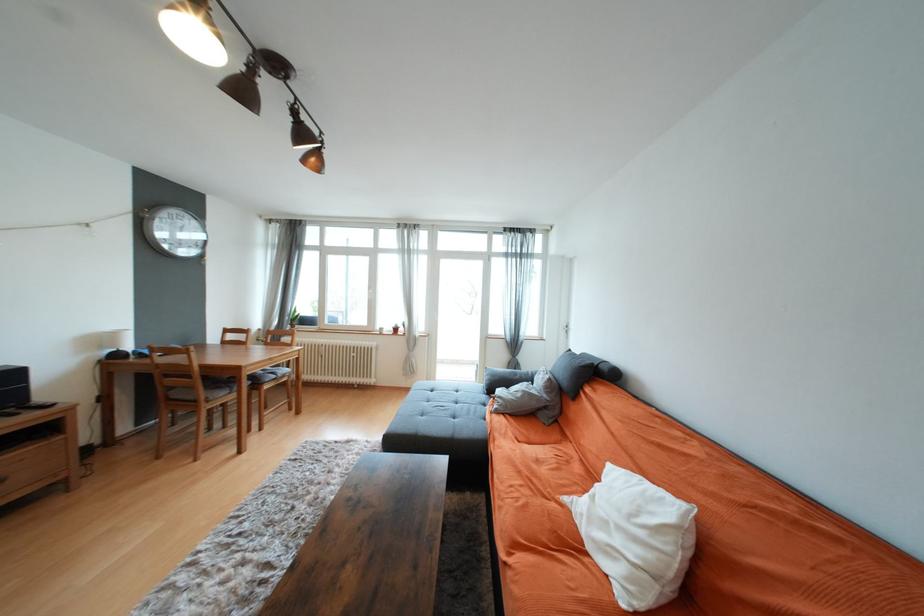
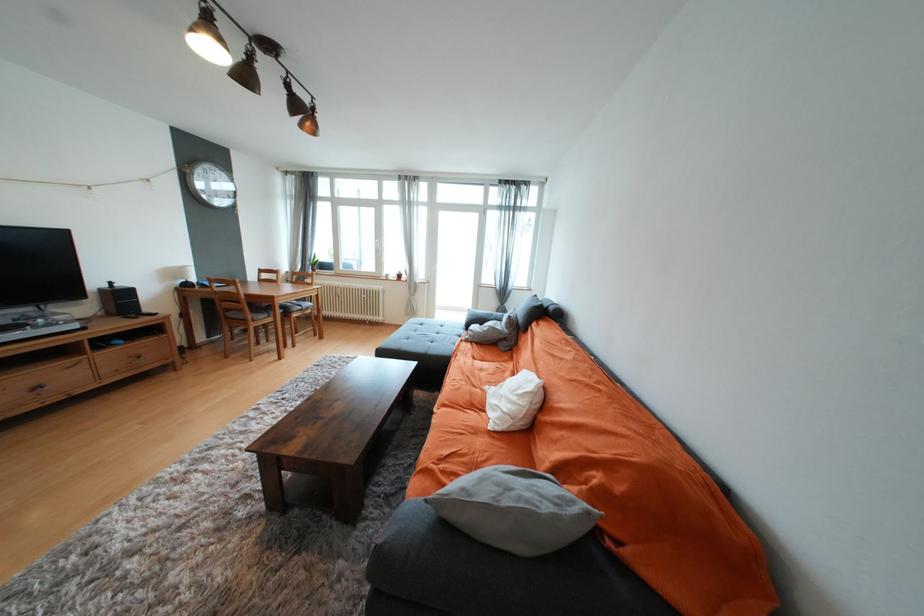
The point at (45, 400) is marked in the first image. Where is the corresponding point in the second image?

(152, 312)